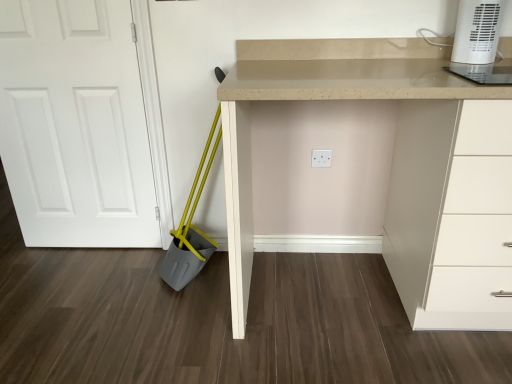
The image size is (512, 384). In order to click on free space underneath beige laminate desk at center (from a real-world perspective) in this screenshot , I will do `click(351, 295)`.